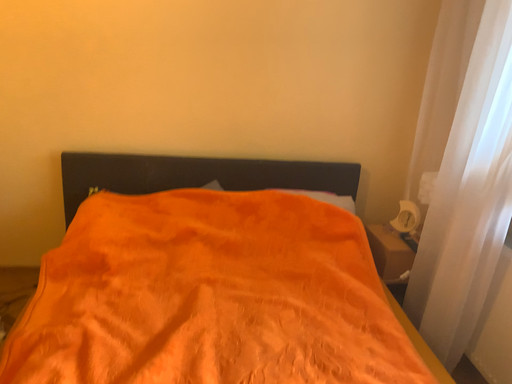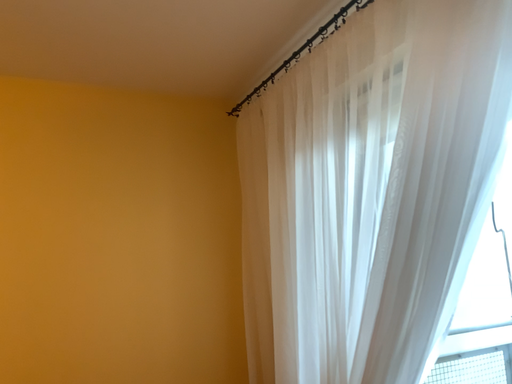
Question: How did the camera likely rotate when shooting the video?

Choices:
 (A) rotated upward
 (B) rotated downward

Answer: (A)